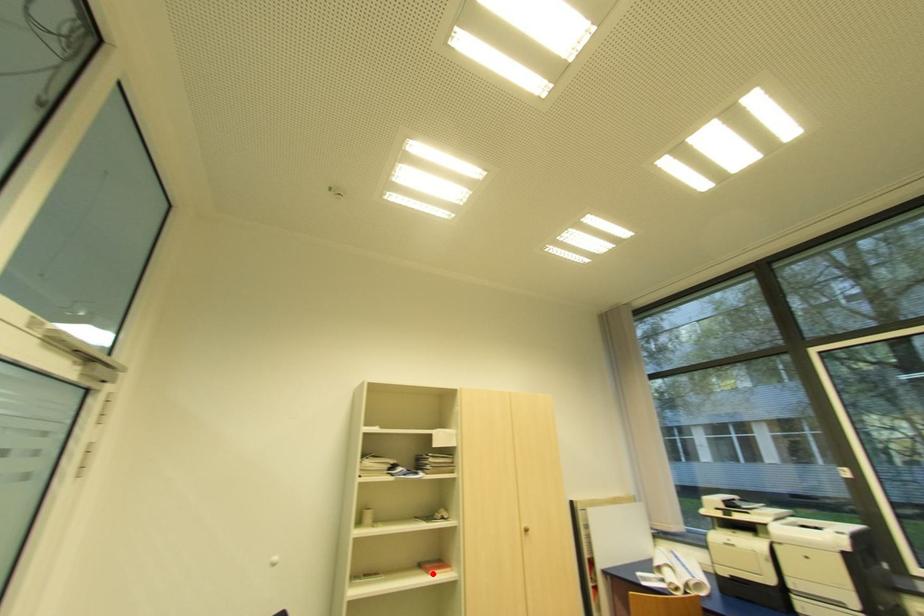
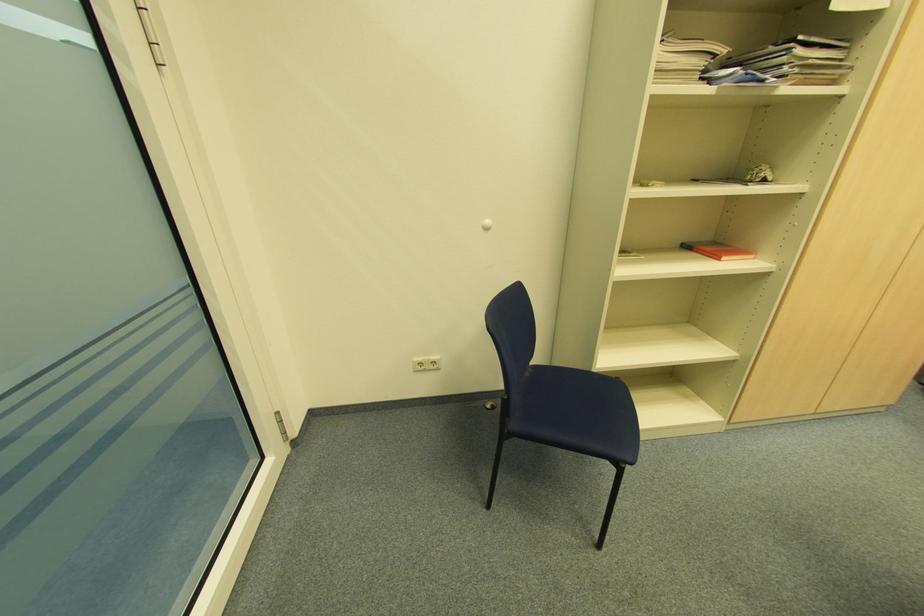
Locate, in the second image, the point that corresponds to the highlighted location in the first image.

(726, 257)